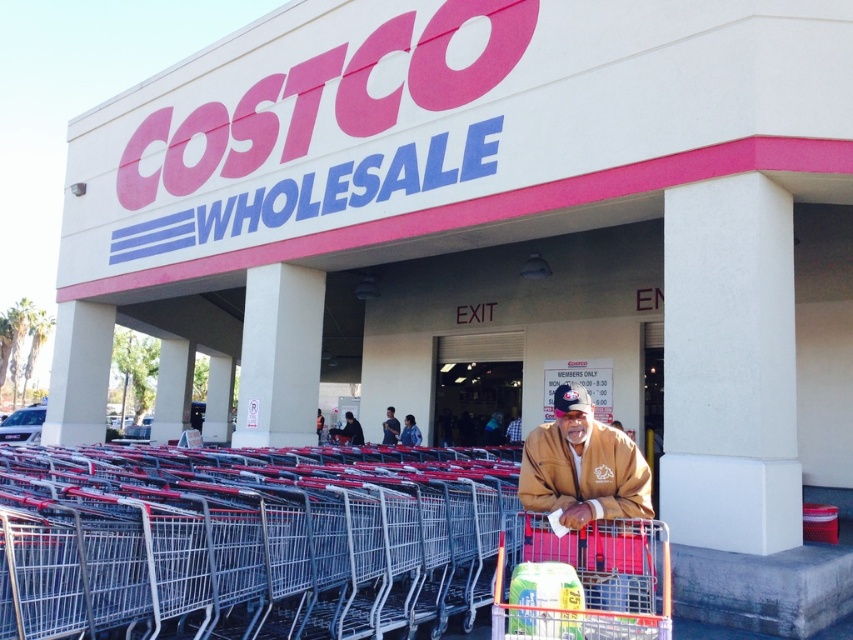
Question: Is dark blue fabric jacket at center thinner than blue denim jeans at center?

Choices:
 (A) yes
 (B) no

Answer: (B)

Question: Can you confirm if metallic silver shopping cart at left is positioned above metallic silver shopping cart at center?

Choices:
 (A) yes
 (B) no

Answer: (B)

Question: Does metallic silver shopping cart at center appear on the right side of blue denim jeans at center?

Choices:
 (A) yes
 (B) no

Answer: (A)

Question: Among these points, which one is nearest to the camera?

Choices:
 (A) (358, 525)
 (B) (396, 433)
 (C) (608, 518)
 (D) (347, 412)

Answer: (C)

Question: Which point appears closest to the camera in this image?

Choices:
 (A) (320, 410)
 (B) (387, 413)
 (C) (590, 531)

Answer: (C)

Question: Which point is farther from the camera taking this photo?

Choices:
 (A) 390,440
 (B) 654,566

Answer: (A)